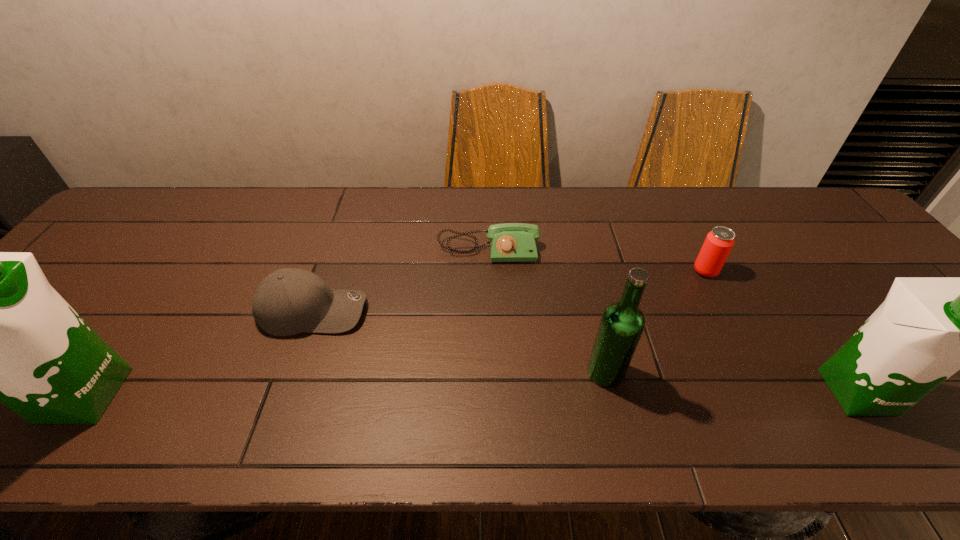
To make them evenly spaced by inserting another soya_milk among them, please locate a vacant spot for this new soya_milk. Please provide its 2D coordinates. Your answer should be formatted as a tuple, i.e. [(x, y)], where the tuple contains the x and y coordinates of a point satisfying the conditions above.

[(471, 393)]